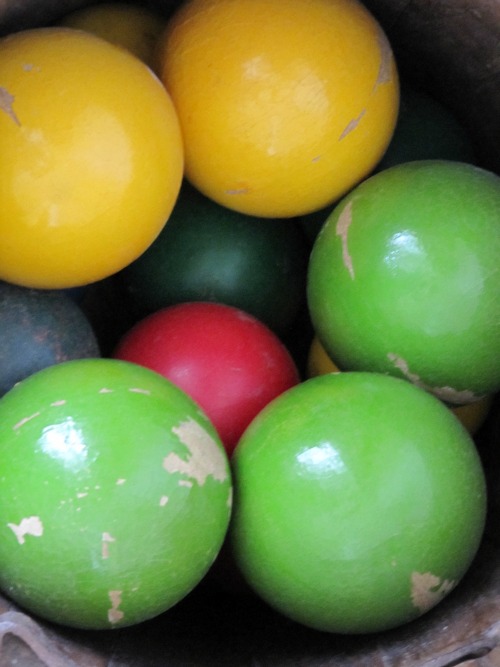
The height and width of the screenshot is (667, 500). What are the coordinates of `possible bucket type object` in the screenshot? It's located at (452, 641).